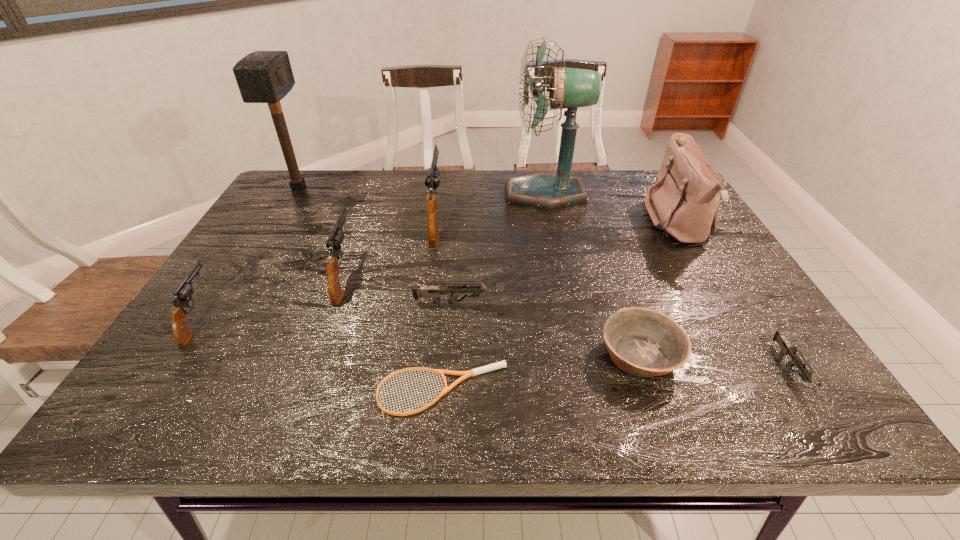
Find the location of a particular element. The height and width of the screenshot is (540, 960). the farther grey gun is located at coordinates (434, 292).

Identify the location of bowl. (642, 342).

Image resolution: width=960 pixels, height=540 pixels. Find the location of `the rightmost gun`. the rightmost gun is located at coordinates (786, 349).

Where is `the shortest gun`? the shortest gun is located at coordinates (786, 349).

Where is `the shortest object`? The width and height of the screenshot is (960, 540). the shortest object is located at coordinates (502, 364).

At what (x,y) coordinates should I click in order to perform the action: click on beige tennis racket. Please return your answer as a coordinate pair (x, y). Looking at the image, I should click on (502, 364).

I want to click on free space located in front of the fan where the wind blows, so click(x=425, y=194).

Identify the location of free space located in front of the fan where the wind blows. (428, 194).

You are a GUI agent. You are given a task and a screenshot of the screen. Output one action in this format:
    pyautogui.click(x=<x>, y=<y>)
    Task: Click on the free spot located 0.390m in front of the fan where the wind blows
    Image resolution: width=960 pixels, height=540 pixels.
    Given the screenshot: What is the action you would take?
    pyautogui.click(x=380, y=194)

Locate an element on the screen. This screenshot has height=540, width=960. vacant space located on the front of the mallet is located at coordinates (256, 254).